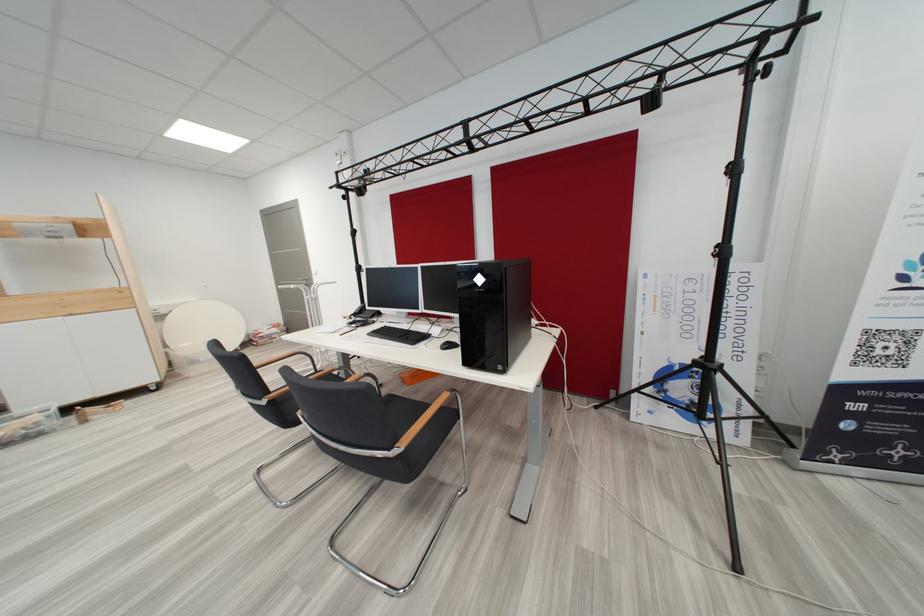
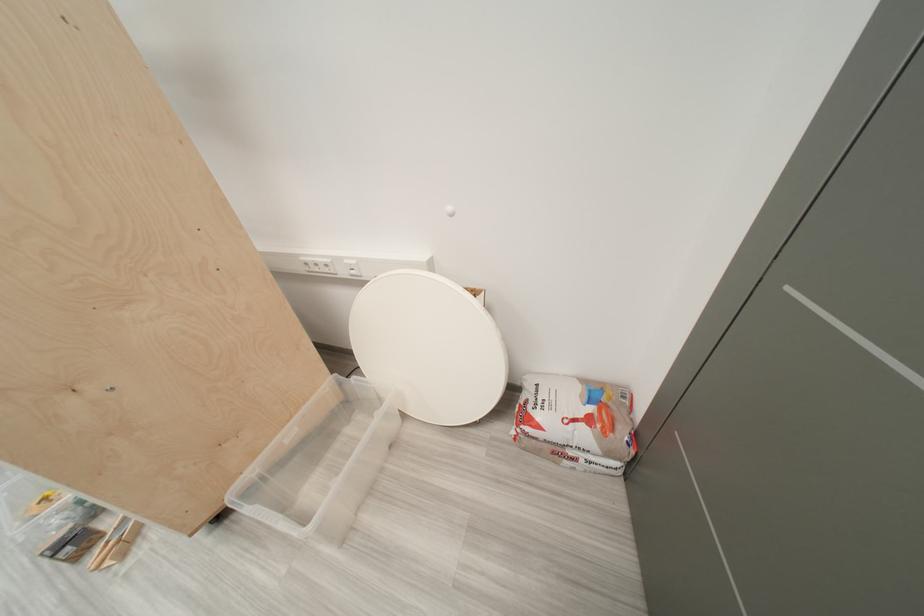
The point at (285,342) is marked in the first image. Where is the corresponding point in the second image?

(577, 464)